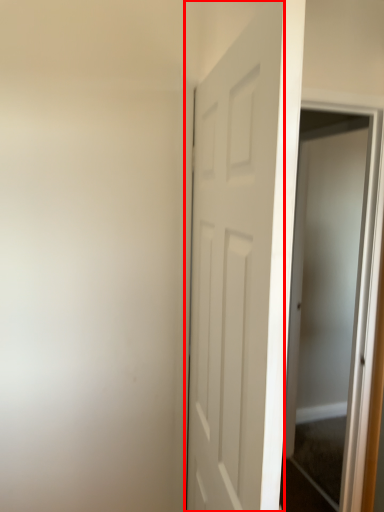
Question: In this image, where is door (annotated by the red box) located relative to screen door?

Choices:
 (A) left
 (B) right

Answer: (A)